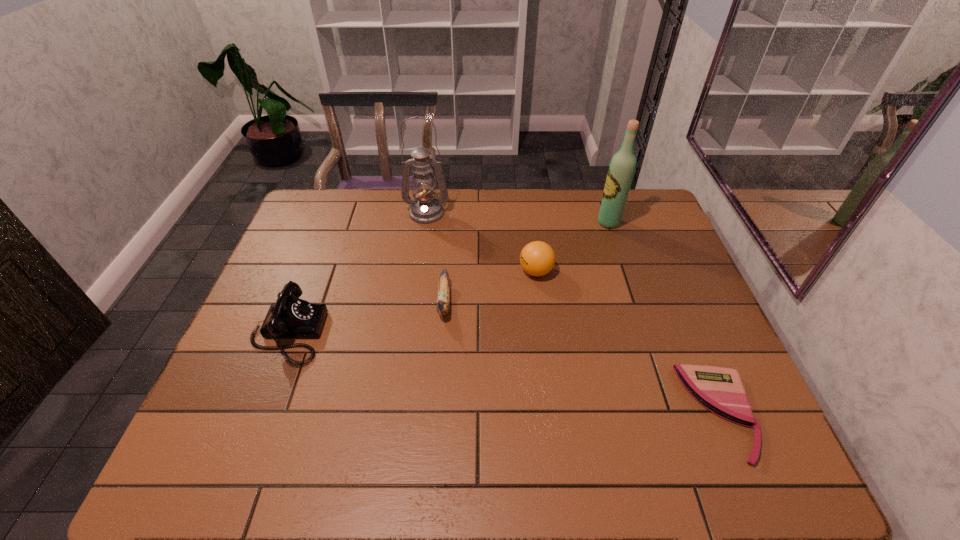
Where is `free spot between the banana and the oil lamp`? This screenshot has width=960, height=540. free spot between the banana and the oil lamp is located at coordinates (436, 258).

Locate an element on the screen. empty space that is in between the shortest object and the ping-pong ball is located at coordinates (628, 342).

You are a GUI agent. You are given a task and a screenshot of the screen. Output one action in this format:
    pyautogui.click(x=<x>, y=<y>)
    Task: Click on the free space between the oil lamp and the banana
    
    Given the screenshot: What is the action you would take?
    pyautogui.click(x=436, y=258)

Where is `free area in between the wine bottle and the shortest object`? free area in between the wine bottle and the shortest object is located at coordinates (664, 318).

Where is `free point between the leftmost object and the third object from right to left`? The height and width of the screenshot is (540, 960). free point between the leftmost object and the third object from right to left is located at coordinates (412, 302).

I want to click on free space between the banana and the oil lamp, so click(436, 258).

I want to click on empty space between the third object from right to left and the oil lamp, so click(481, 242).

Locate an element on the screen. Image resolution: width=960 pixels, height=540 pixels. blank region between the oil lamp and the third object from right to left is located at coordinates [x=481, y=242].

This screenshot has width=960, height=540. I want to click on vacant space that is in between the oil lamp and the telephone, so click(357, 273).

This screenshot has height=540, width=960. In order to click on object identified as the closest to the banana in this screenshot , I will do `click(537, 258)`.